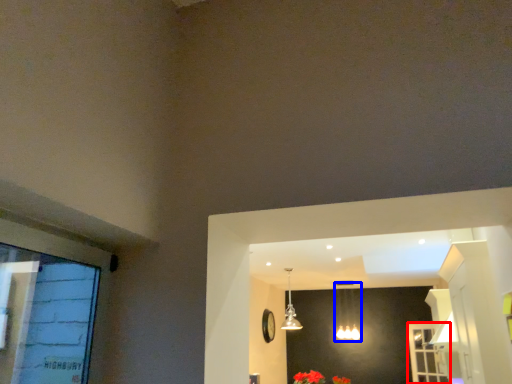
Question: Which of the following is the farthest to the observer, screen door (highlighted by a red box) or lamp (highlighted by a blue box)?

Choices:
 (A) screen door
 (B) lamp

Answer: (B)